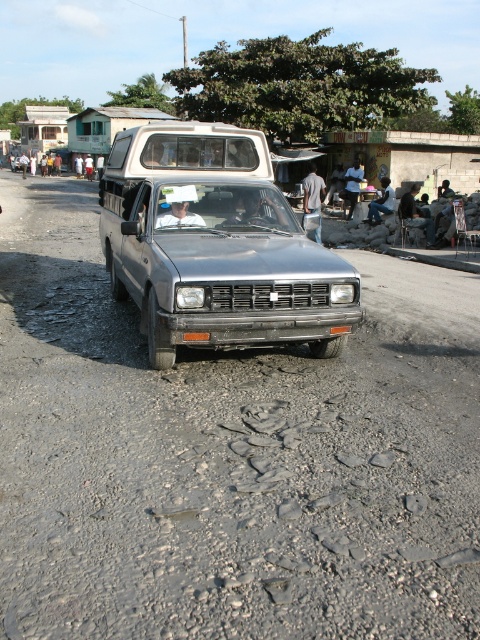
You are a delivery person standing next to the gray fabric shirt at center. You need to hand over a package to the person wearing the white matte shirt at center. Can you reach them without moving from your current position?

The distance between the white matte shirt at center and the gray fabric shirt at center is 7.05 meters. Since the distance is too far, you cannot reach them without moving closer.